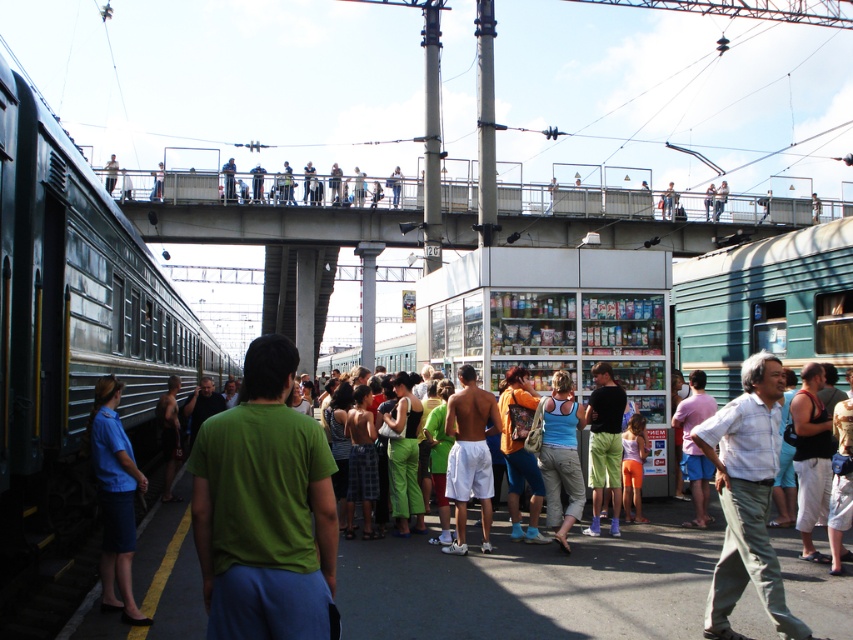
You are standing at the center of the train station and notice both the green matte train at left and the green cotton shirt at center. Which object is closer to your current position?

The green cotton shirt at center is closer to your current position since it is located at the center where you are standing, while the green matte train at left is 16.24 meters away.